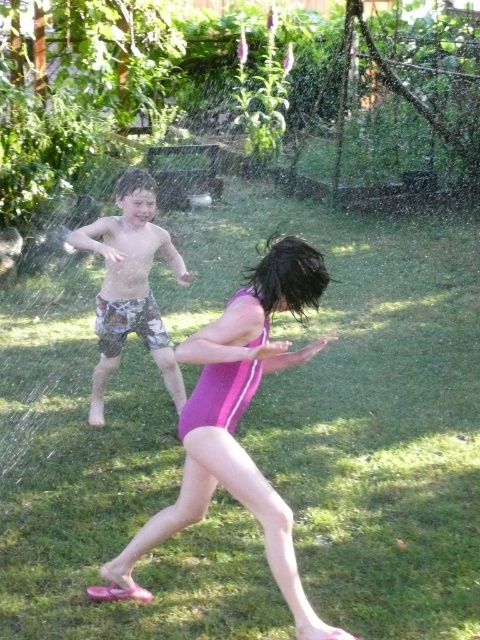
Question: Is green grass at center above camouflage shorts at left?

Choices:
 (A) yes
 (B) no

Answer: (B)

Question: Among these points, which one is nearest to the camera?

Choices:
 (A) (226, 401)
 (B) (129, 273)

Answer: (A)

Question: Which point is farther from the camera taking this photo?

Choices:
 (A) (292, 560)
 (B) (95, 396)
 (C) (212, 248)

Answer: (C)

Question: Estimate the real-world distances between objects in this image. Which object is closer to the purple matte swimsuit at center?

Choices:
 (A) green grass at center
 (B) camouflage shorts at left

Answer: (B)

Question: Does green grass at center have a larger size compared to camouflage shorts at left?

Choices:
 (A) no
 (B) yes

Answer: (A)

Question: Does green grass at center appear on the left side of purple matte swimsuit at center?

Choices:
 (A) yes
 (B) no

Answer: (B)